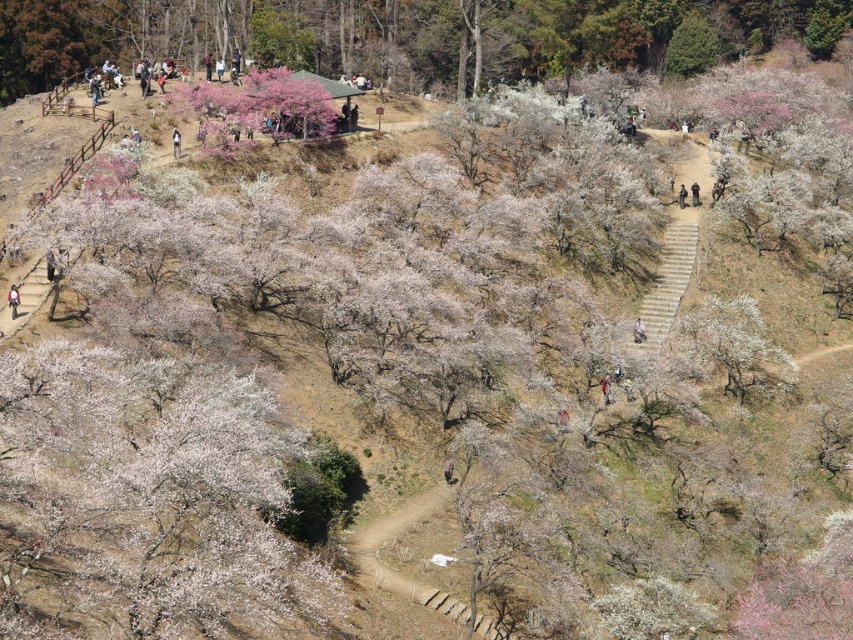
Question: Can you confirm if light brown leather jacket at lower left is thinner than camouflage fabric jacket at center?

Choices:
 (A) yes
 (B) no

Answer: (A)

Question: Where is light brown wooden bench at center located in relation to camouflage fabric jacket at center in the image?

Choices:
 (A) left
 (B) right

Answer: (B)

Question: Which of the following is the closest to the observer?

Choices:
 (A) light brown leather jacket at upper center
 (B) light brown wooden bench at center
 (C) dark brown leather jacket at center
 (D) camouflage fabric jacket at center

Answer: (D)

Question: Can you confirm if light brown leather jacket at lower left is smaller than camouflage fabric jacket at center?

Choices:
 (A) yes
 (B) no

Answer: (A)

Question: Which point is closer to the camera?

Choices:
 (A) camouflage fabric jacket at center
 (B) brown leather jacket at center
 (C) dark brown leather jacket at center
 (D) light brown leather jacket at upper center

Answer: (A)

Question: Which object appears closest to the camera in this image?

Choices:
 (A) light brown leather jacket at upper center
 (B) dark brown leather jacket at center
 (C) pink blossoms at center
 (D) light brown wooden bench at center

Answer: (D)